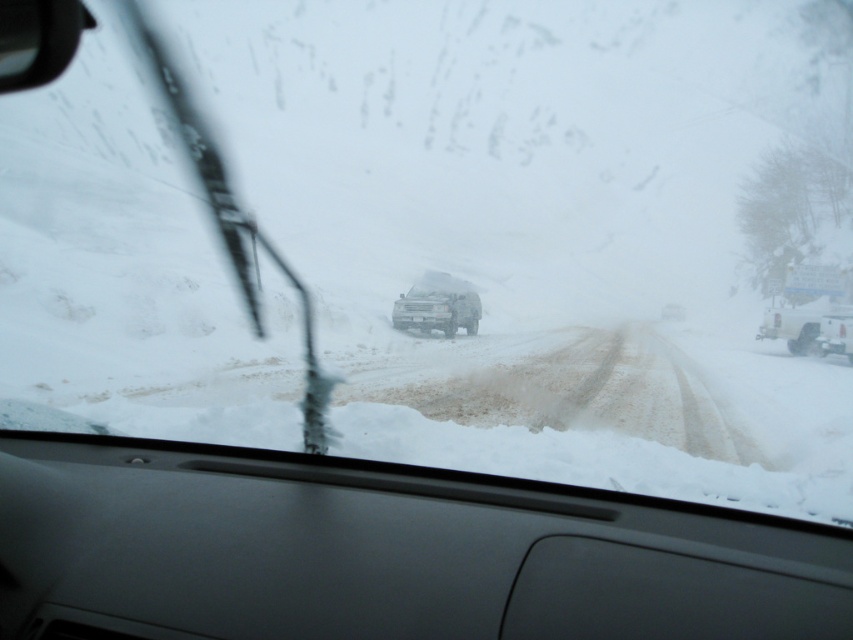
You are a passenger in a car and want to know if the clear glass windshield at center can fully cover the matte gray jeep at center when viewed from your current position. Can it?

The clear glass windshield at center is wider than the matte gray jeep at center, so yes, the clear glass windshield at center can fully cover the matte gray jeep at center when viewed from your current position.

You are driving a car and see the white matte truck at right and the matte gray jeep at center. Which vehicle is closer to you?

The white matte truck at right is closer to you because it is in front of the matte gray jeep at center.